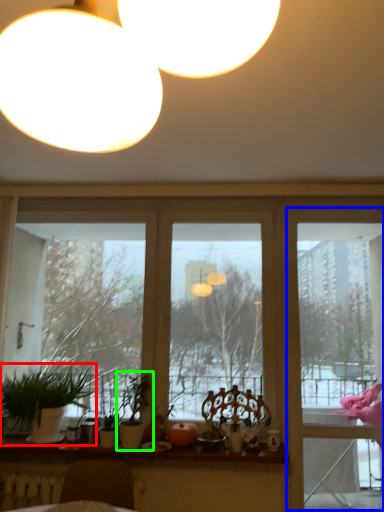
Question: Considering the real-world distances, which object is closest to houseplant (highlighted by a red box)? screen door (highlighted by a blue box) or houseplant (highlighted by a green box).

Choices:
 (A) screen door
 (B) houseplant

Answer: (B)